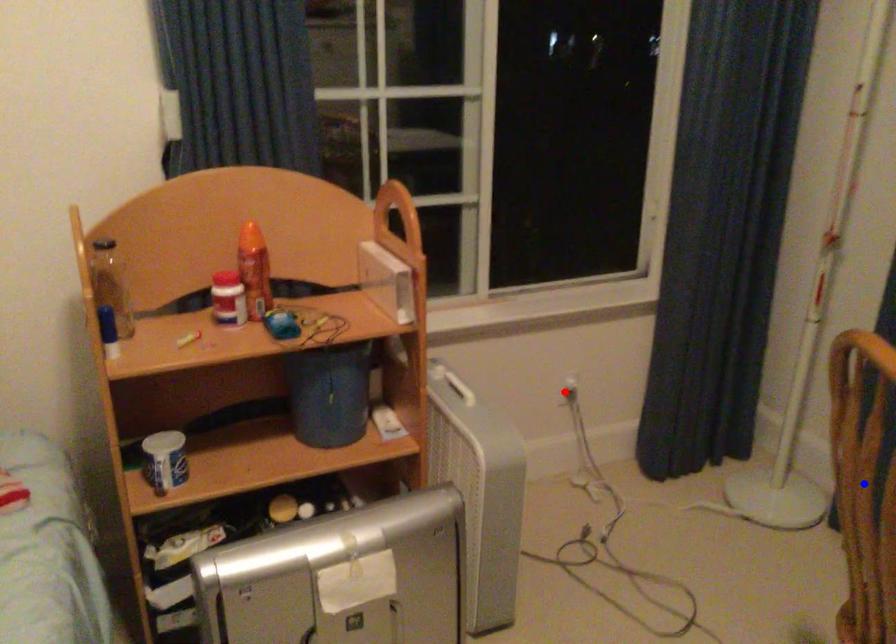
Question: Two points are marked on the image. Which point is closer to the camera?

Choices:
 (A) Blue point is closer.
 (B) Red point is closer.

Answer: (A)